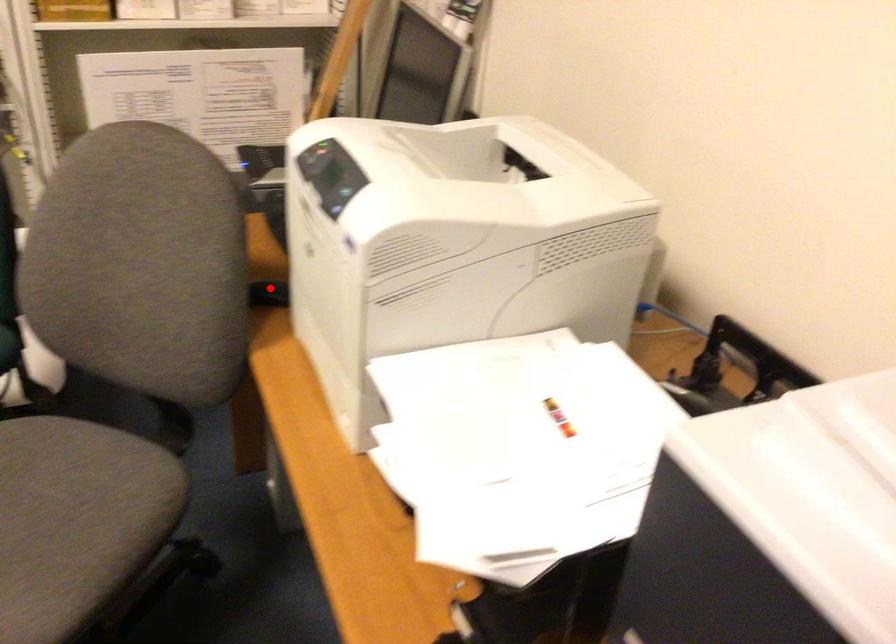
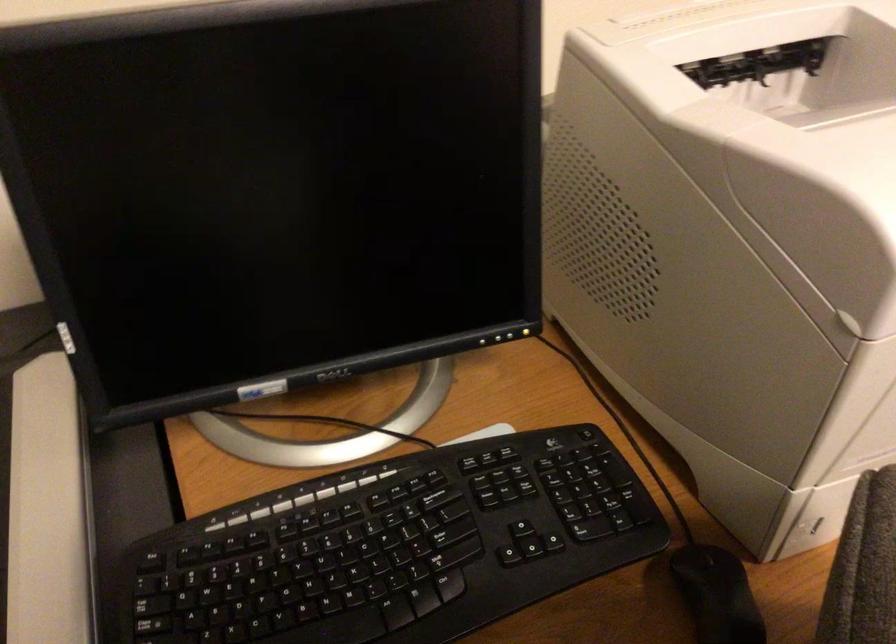
Find the pixel in the second image that matches the highlighted location in the first image.

(717, 594)